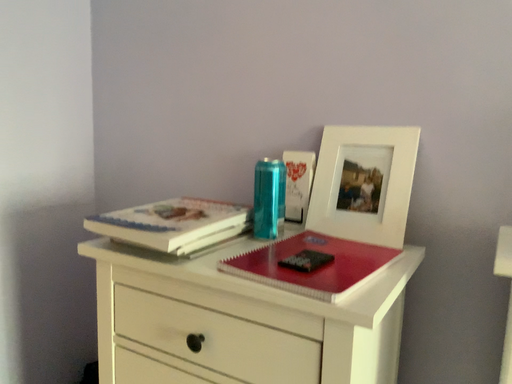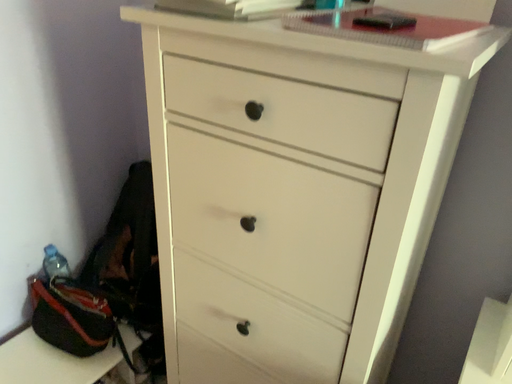
Question: Which way did the camera rotate in the video?

Choices:
 (A) rotated downward
 (B) rotated upward

Answer: (A)